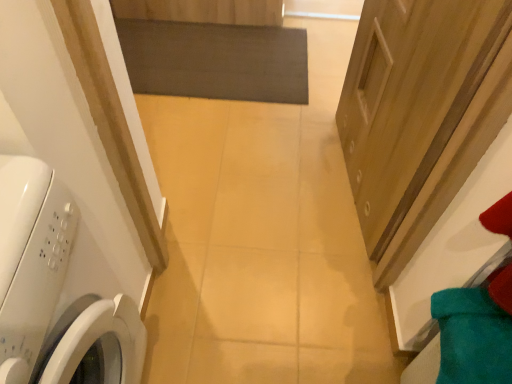
Question: From a real-world perspective, is wooden door at right positioned above or below dark gray matte mat at center?

Choices:
 (A) below
 (B) above

Answer: (B)

Question: In the image, is wooden door at right positioned in front of or behind dark gray matte mat at center?

Choices:
 (A) behind
 (B) front

Answer: (B)

Question: Which object is positioned closest to the dark gray matte mat at center?

Choices:
 (A) wooden door at right
 (B) white glossy washing machine at left

Answer: (A)

Question: Based on their relative distances, which object is farther from the dark gray matte mat at center?

Choices:
 (A) white glossy washing machine at left
 (B) wooden door at right

Answer: (A)